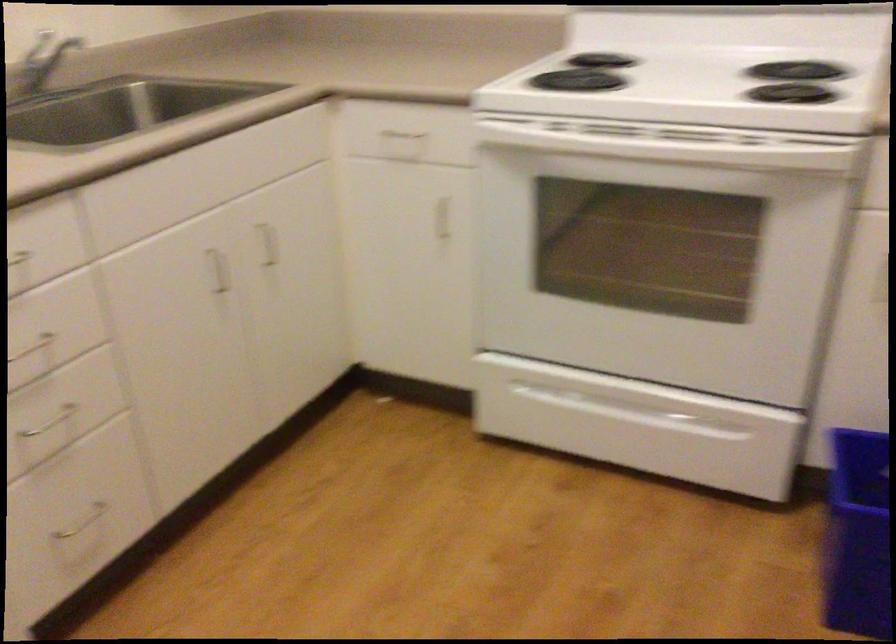
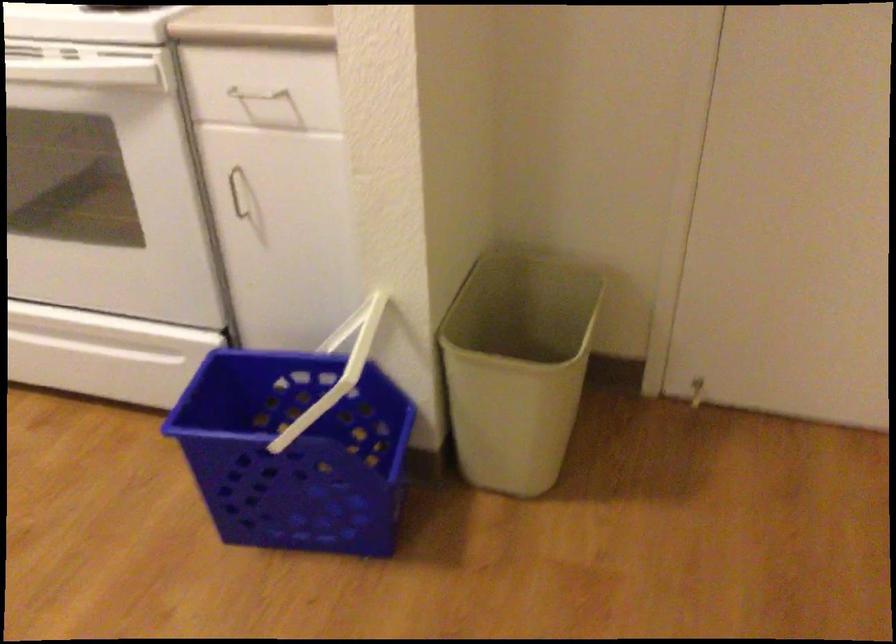
The point at (726, 258) is marked in the first image. Where is the corresponding point in the second image?

(104, 185)